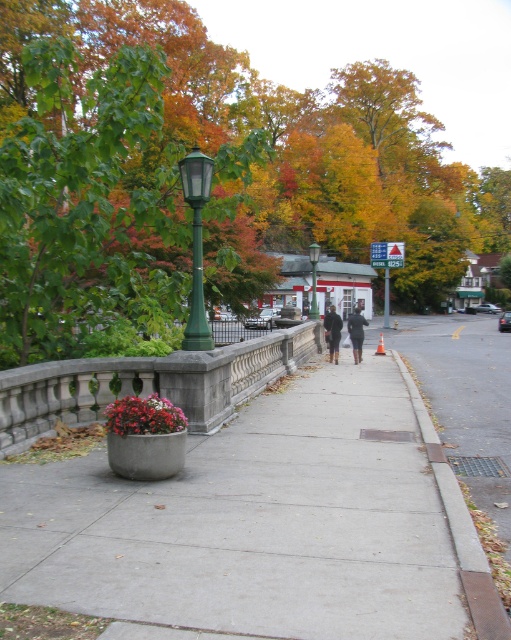
You are a delivery person who needs to place a small package between the dark brown leather jacket at center and the dark brown leather boots at center on the sidewalk. Can you fit the package between them without moving either object?

The dark brown leather jacket at center is taller than the dark brown leather boots at center, so there is vertical space between them. The package can be placed in the space between the jacket and boots as long as it is smaller than the vertical gap between them.

You are standing at the beginning of the sidewalk in the urban scene. You see two points marked on the path ahead. The first point is at coordinates point (384, 440) and the second is at point (475, 576). As you walk forward, which point will you encounter first?

You will encounter point (384, 440) first because it is closer to you than point (475, 576), which is further away.

You are a delivery person trying to navigate a small cart along the path. The cart requires a minimum width of 1.2 meters to move safely. Given the concrete sidewalk at center and the gray concrete curb at lower right, which path should you choose to ensure safe passage?

The concrete sidewalk at center has a larger width than the gray concrete curb at lower right, so you should choose the concrete sidewalk at center for safe passage as it meets the minimum width requirement.